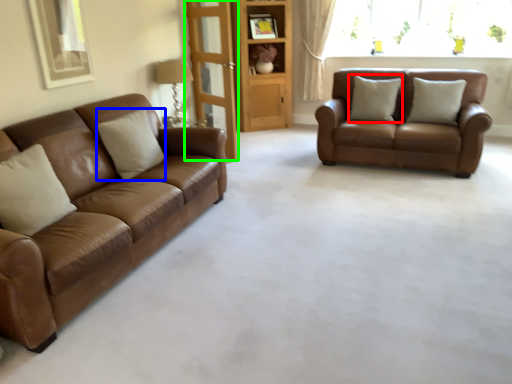
Question: Which is farther away from pillow (highlighted by a red box)? pillow (highlighted by a blue box) or glass door (highlighted by a green box)?

Choices:
 (A) pillow
 (B) glass door

Answer: (A)